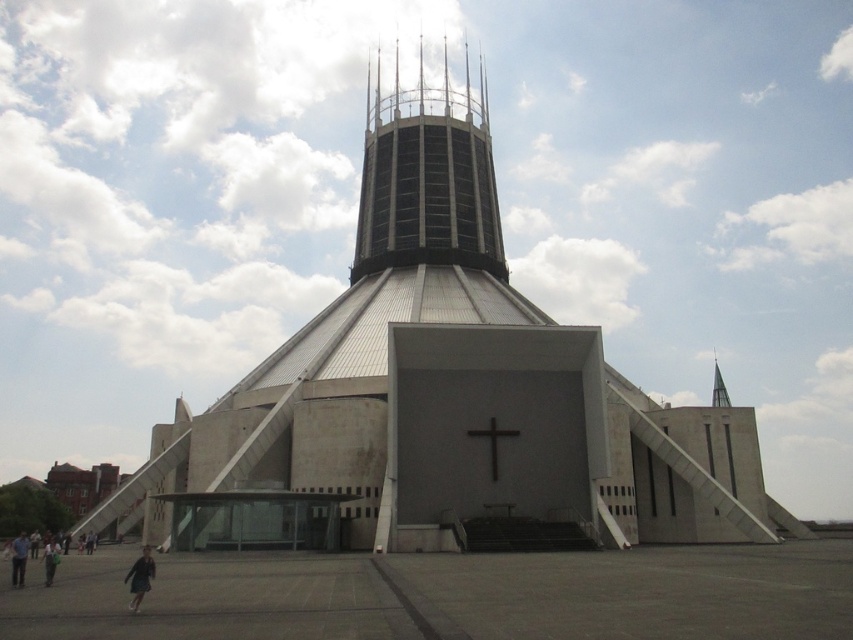
Question: Which object is the farthest from the dark blue coat at lower left?

Choices:
 (A) dark blue jeans at lower left
 (B) shiny silver spire at upper right
 (C) white concrete church at center
 (D) metallic cross at center

Answer: (B)

Question: Which point is closer to the camera?

Choices:
 (A) white concrete church at center
 (B) dark blue jeans at lower left
 (C) shiny silver spire at upper right

Answer: (B)

Question: Does dark blue jeans at lower left have a greater width compared to shiny silver spire at upper right?

Choices:
 (A) no
 (B) yes

Answer: (B)

Question: Which of these objects is positioned farthest from the white concrete church at center?

Choices:
 (A) dark gray fabric jacket at lower left
 (B) dark blue coat at lower left
 (C) dark blue jeans at lower left
 (D) dark gray glass dome at center

Answer: (C)

Question: Does white concrete church at center lie in front of dark gray fabric jacket at lower left?

Choices:
 (A) no
 (B) yes

Answer: (A)

Question: In this image, where is white concrete church at center located relative to shiny silver spire at upper right?

Choices:
 (A) above
 (B) below

Answer: (A)